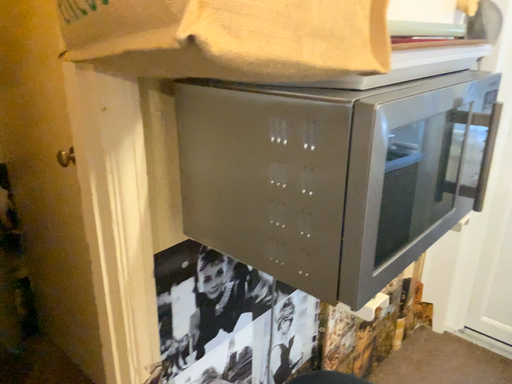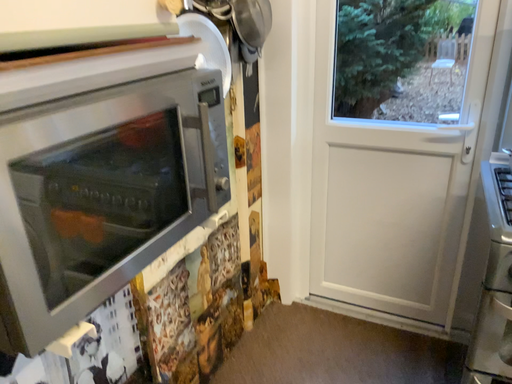
Question: How did the camera likely rotate when shooting the video?

Choices:
 (A) rotated right
 (B) rotated left

Answer: (A)